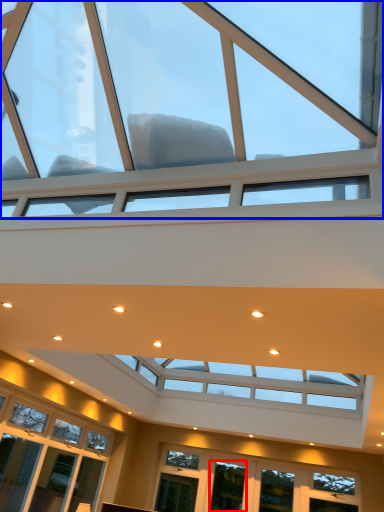
Question: Among these objects, which one is farthest to the camera, window (highlighted by a red box) or window (highlighted by a blue box)?

Choices:
 (A) window
 (B) window

Answer: (A)